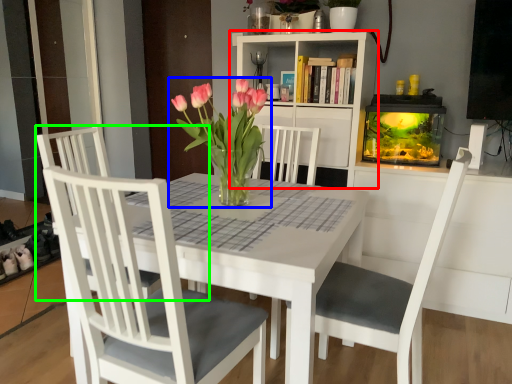
Question: Considering the real-world distances, which object is closest to bookcase (highlighted by a red box)? houseplant (highlighted by a blue box) or chair (highlighted by a green box).

Choices:
 (A) houseplant
 (B) chair

Answer: (A)